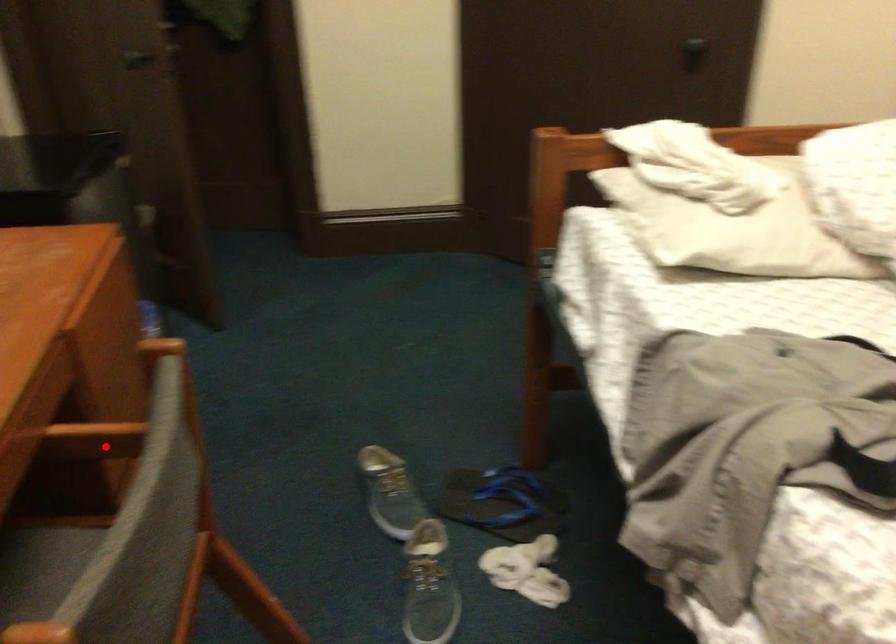
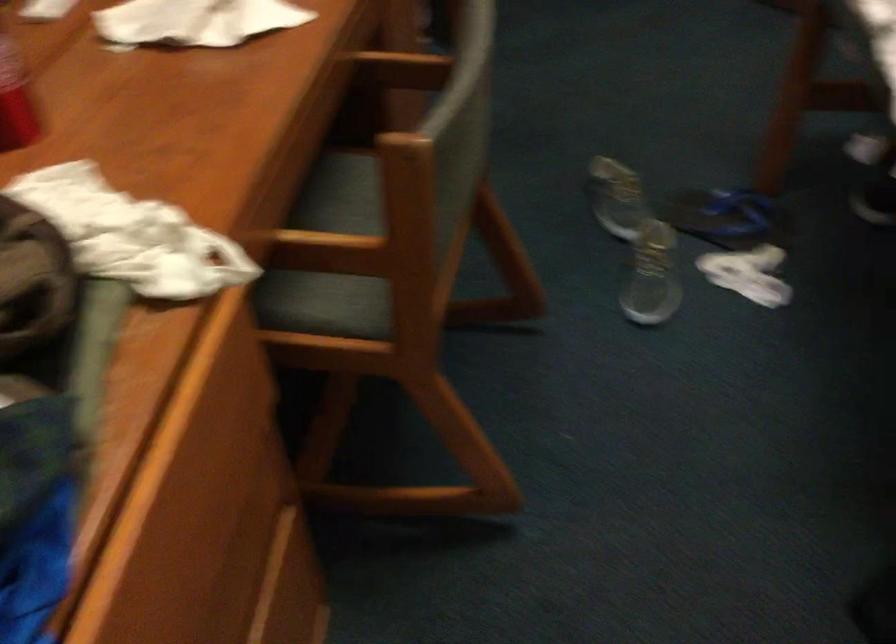
Locate, in the second image, the point that corresponds to the highlighted location in the first image.

(401, 69)